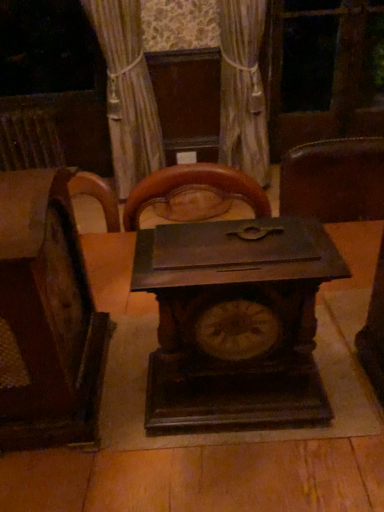
Question: From their relative heights in the image, would you say silky beige curtain at upper center is taller or shorter than dark brown wood clock at center?

Choices:
 (A) short
 (B) tall

Answer: (B)

Question: Choose the correct answer: Is silky beige curtain at upper center inside dark brown wood clock at center or outside it?

Choices:
 (A) inside
 (B) outside

Answer: (B)

Question: Estimate the real-world distances between objects in this image. Which object is closer to the dark wood table at center?

Choices:
 (A) wooden chair at left
 (B) silky beige curtain at upper center
 (C) rusty metal radiator at left
 (D) dark brown wood clock at center
 (E) transparent glass screen door at upper center

Answer: (D)

Question: Estimate the real-world distances between objects in this image. Which object is closer to the rusty metal radiator at left?

Choices:
 (A) dark wood table at center
 (B) transparent glass screen door at upper center
 (C) wooden chair at left
 (D) silky beige curtain at upper center
 (E) dark brown wood clock at center

Answer: (D)